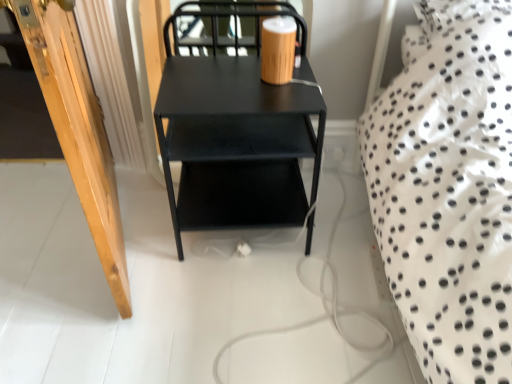
In order to face wooden door at left, should I rotate leftwards or rightwards?

It's best to rotate left around 21.723 degrees.

What do you see at coordinates (78, 131) in the screenshot? I see `wooden door at left` at bounding box center [78, 131].

The width and height of the screenshot is (512, 384). Find the location of `wooden door at left`. wooden door at left is located at coordinates (78, 131).

The width and height of the screenshot is (512, 384). What are the coordinates of `matte black table at center` in the screenshot? It's located at (234, 144).

What do you see at coordinates (234, 144) in the screenshot?
I see `matte black table at center` at bounding box center [234, 144].

Measure the distance between matte black table at center and camera.

matte black table at center is 3.58 feet away from camera.

Where is `wooden door at left`? Image resolution: width=512 pixels, height=384 pixels. wooden door at left is located at coordinates (78, 131).

Between matte black table at center and wooden door at left, which one appears on the left side from the viewer's perspective?

Positioned to the left is wooden door at left.

From the picture: Is the position of matte black table at center less distant than that of wooden door at left?

No, it is not.

Does point (204, 143) come in front of point (88, 189)?

No.

From the image's perspective, which object appears higher, matte black table at center or wooden door at left?

wooden door at left, from the image's perspective.

From a real-world perspective, is matte black table at center located beneath wooden door at left?

Yes, from a real-world perspective, matte black table at center is beneath wooden door at left.

Can you confirm if matte black table at center is wider than wooden door at left?

In fact, matte black table at center might be narrower than wooden door at left.

In the scene shown: Is matte black table at center taller than wooden door at left?

No.

Which of these two, matte black table at center or wooden door at left, is bigger?

matte black table at center.

Is matte black table at center situated inside wooden door at left or outside?

matte black table at center is spatially situated outside wooden door at left.

Is matte black table at center next to wooden door at left?

No, matte black table at center is not beside wooden door at left.

Is matte black table at center turned away from wooden door at left?

matte black table at center does not have its back to wooden door at left.

What's the angular difference between matte black table at center and wooden door at left's facing directions?

The angular difference between matte black table at center and wooden door at left is 15.8 degrees.

Measure the distance between matte black table at center and wooden door at left.

matte black table at center is 14.40 inches from wooden door at left.

Locate an element on the screen. The width and height of the screenshot is (512, 384). door on the left of the matte black table at center is located at coordinates (78, 131).

Can you confirm if wooden door at left is positioned to the left of matte black table at center?

Correct, you'll find wooden door at left to the left of matte black table at center.

Is wooden door at left positioned before matte black table at center?

Yes, wooden door at left is closer to the viewer.

Is point (89, 178) more distant than point (294, 187)?

No.

From the image's perspective, between wooden door at left and matte black table at center, which one is located above?

wooden door at left, from the image's perspective.

From a real-world perspective, which is physically below, wooden door at left or matte black table at center?

matte black table at center.

Can you confirm if wooden door at left is thinner than matte black table at center?

In fact, wooden door at left might be wider than matte black table at center.

Considering the sizes of objects wooden door at left and matte black table at center in the image provided, who is taller, wooden door at left or matte black table at center?

wooden door at left is taller.

Considering the relative sizes of wooden door at left and matte black table at center in the image provided, is wooden door at left smaller than matte black table at center?

Yes, wooden door at left is smaller than matte black table at center.

Is matte black table at center a part of wooden door at left?

That's incorrect, matte black table at center is not inside wooden door at left.

Is wooden door at left directly adjacent to matte black table at center?

They are not placed beside each other.

Does wooden door at left turn towards matte black table at center?

No, wooden door at left does not turn towards matte black table at center.

Can you tell me how much wooden door at left and matte black table at center differ in facing direction?

There is a 15.8-degree angle between the facing directions of wooden door at left and matte black table at center.

The height and width of the screenshot is (384, 512). Find the location of `door that is above the matte black table at center (from the image's perspective)`. door that is above the matte black table at center (from the image's perspective) is located at coordinates (78, 131).

You are a GUI agent. You are given a task and a screenshot of the screen. Output one action in this format:
    pyautogui.click(x=<x>, y=<y>)
    Task: Click on the table on the right of wooden door at left
    This screenshot has width=512, height=384.
    Given the screenshot: What is the action you would take?
    pyautogui.click(x=234, y=144)

You are a GUI agent. You are given a task and a screenshot of the screen. Output one action in this format:
    pyautogui.click(x=<x>, y=<y>)
    Task: Click on the door that is on the left side of matte black table at center
    
    Given the screenshot: What is the action you would take?
    pyautogui.click(x=78, y=131)